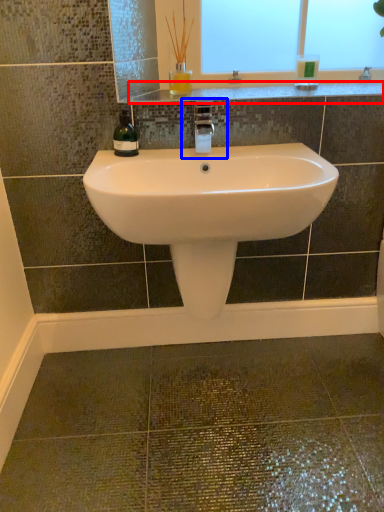
Question: Which of the following is the closest to the observer, counter top (highlighted by a red box) or plumbing fixture (highlighted by a blue box)?

Choices:
 (A) counter top
 (B) plumbing fixture

Answer: (B)